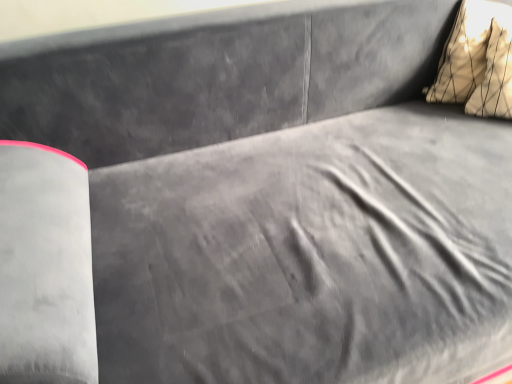
The image size is (512, 384). What do you see at coordinates (477, 61) in the screenshot? I see `gold metallic pillow at upper right` at bounding box center [477, 61].

In order to face gold metallic pillow at upper right, should I rotate leftwards or rightwards?

Turn right approximately 28.898 degrees to face it.

Find the location of `gold metallic pillow at upper right`. gold metallic pillow at upper right is located at coordinates (477, 61).

What is the approximate width of gold metallic pillow at upper right?

It is 8.44 inches.

The height and width of the screenshot is (384, 512). Identify the location of gold metallic pillow at upper right. (477, 61).